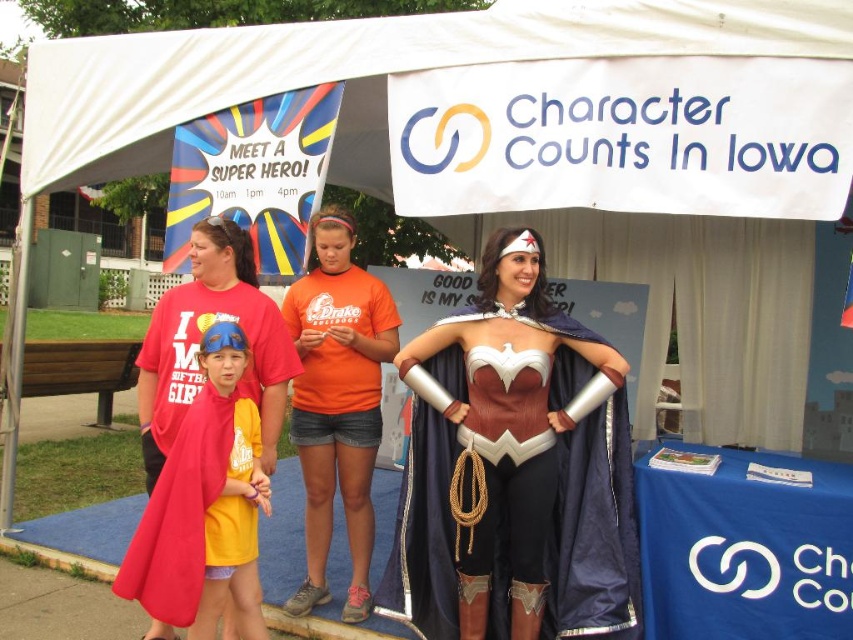
Question: Does shiny red cape at center have a larger size compared to shiny metallic costume at center?

Choices:
 (A) no
 (B) yes

Answer: (A)

Question: Which object appears closest to the camera in this image?

Choices:
 (A) shiny metallic costume at center
 (B) shiny red cape at center

Answer: (A)

Question: Which object is the farthest from the white fabric canopy at upper center?

Choices:
 (A) matte yellow t-shirt at center
 (B) shiny metallic costume at center
 (C) shiny red cape at center

Answer: (A)

Question: Can you confirm if shiny red cape at center is thinner than shiny metallic costume at center?

Choices:
 (A) yes
 (B) no

Answer: (B)

Question: Can you confirm if shiny metallic costume at center is wider than white fabric canopy at upper center?

Choices:
 (A) yes
 (B) no

Answer: (B)

Question: Among these objects, which one is farthest from the camera?

Choices:
 (A) shiny red cape at center
 (B) matte yellow t-shirt at center
 (C) shiny metallic costume at center
 (D) white fabric canopy at upper center

Answer: (A)